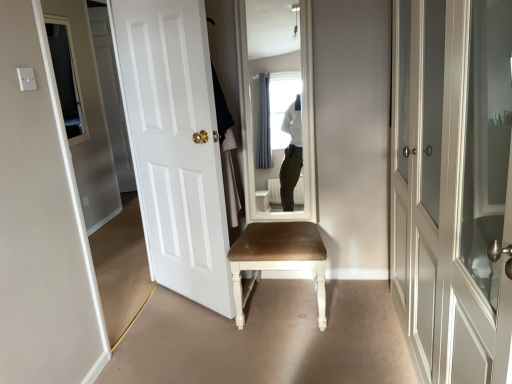
Question: Relative to white painted wood door at center, the 2th door from the left, is white cotton robe at center in front or behind?

Choices:
 (A) front
 (B) behind

Answer: (B)

Question: Is white cotton robe at center inside or outside of white painted wood door at center, which appears as the second door when viewed from the right?

Choices:
 (A) inside
 (B) outside

Answer: (B)

Question: Which of these objects is positioned farthest from the white matte door at left, arranged as the third door when viewed from the right?

Choices:
 (A) matte gray wardrobe at right, the first door viewed from the right
 (B) white cotton robe at center
 (C) brown leather chair at center
 (D) white painted wood door at center, the 2th door from the left

Answer: (A)

Question: Estimate the real-world distances between objects in this image. Which object is closer to the matte gray wardrobe at right, the first door viewed from the right?

Choices:
 (A) white cotton robe at center
 (B) white matte door at left, acting as the 1th door starting from the left
 (C) white painted wood door at center, which appears as the second door when viewed from the right
 (D) brown leather chair at center

Answer: (D)